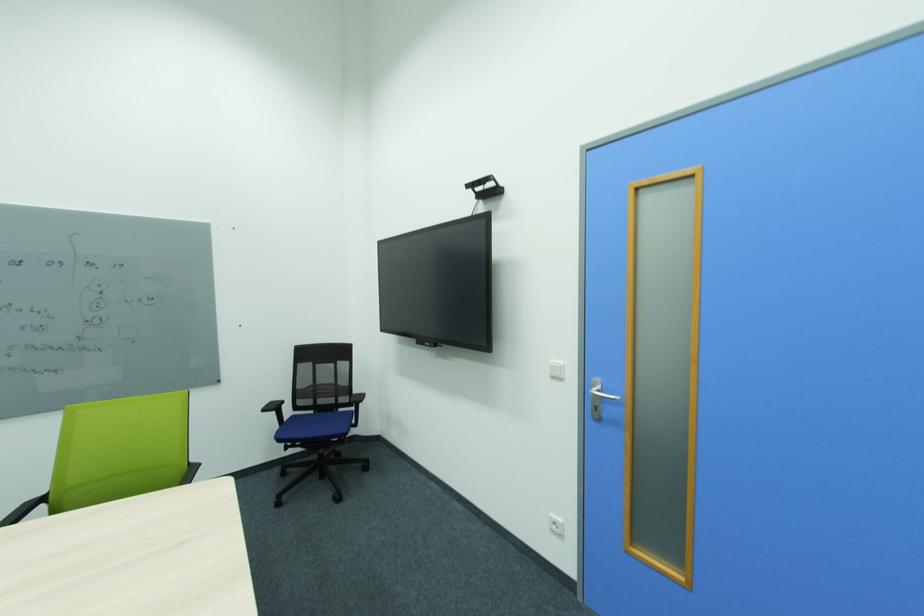
The image size is (924, 616). What do you see at coordinates (600, 403) in the screenshot? I see `the silver door handle` at bounding box center [600, 403].